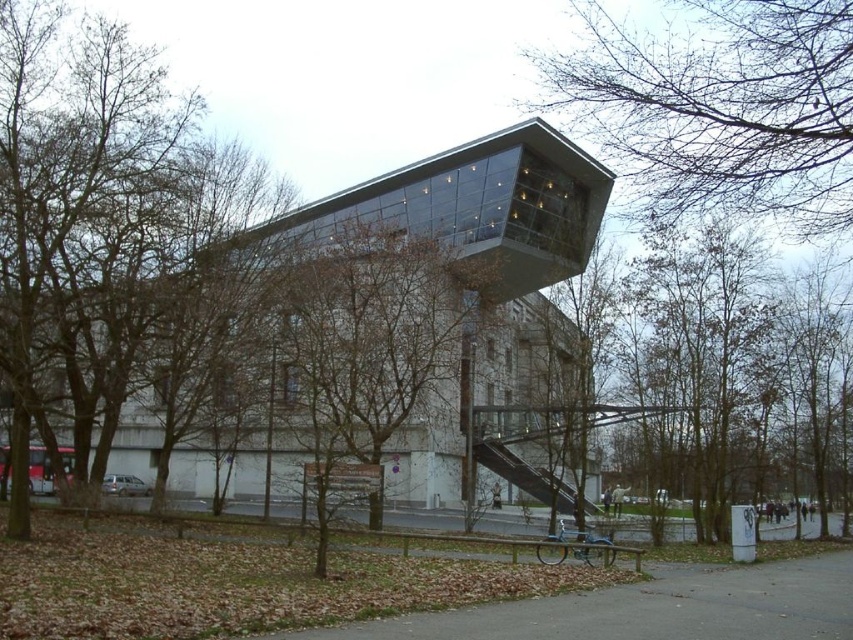
Find the location of a particular element. Image resolution: width=853 pixels, height=640 pixels. bare branches at upper center is located at coordinates (720, 106).

Between point (683, 200) and point (279, 276), which one is positioned in front?

Point (683, 200) is more forward.

Image resolution: width=853 pixels, height=640 pixels. I want to click on bare branches at upper center, so click(x=720, y=106).

Find the location of a particular element. Image resolution: width=853 pixels, height=640 pixels. bare branches at upper center is located at coordinates pyautogui.click(x=720, y=106).